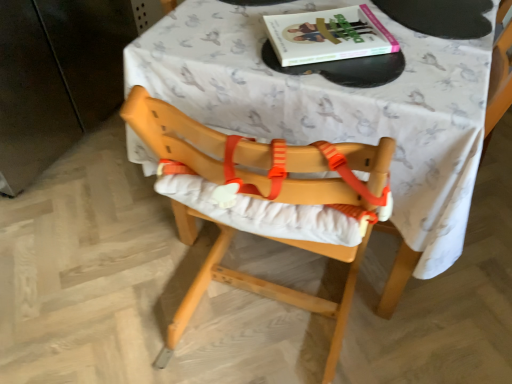
The height and width of the screenshot is (384, 512). I want to click on vacant space to the right of hardcover book at upper center, so click(x=445, y=59).